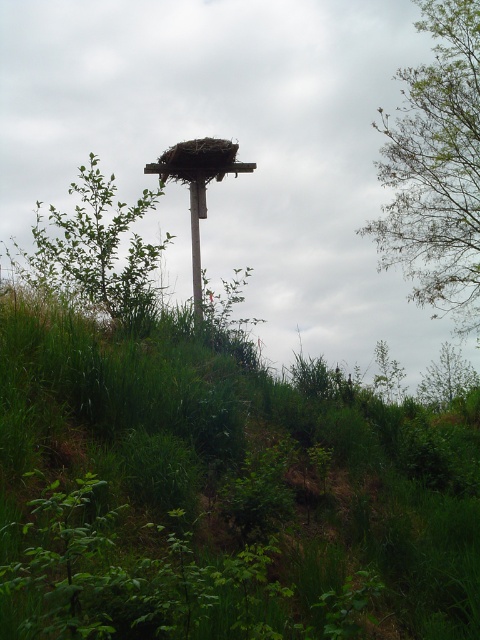
Is green grass at center thinner than green leafy tree at upper right?

Incorrect, green grass at center's width is not less than green leafy tree at upper right's.

Who is more forward, (137, 483) or (443, 13)?

Point (137, 483)

This screenshot has height=640, width=480. What do you see at coordinates (222, 492) in the screenshot?
I see `green grass at center` at bounding box center [222, 492].

This screenshot has height=640, width=480. I want to click on green grass at center, so click(222, 492).

Does green grass at center lie in front of green leafy tree at center?

Yes, it is in front of green leafy tree at center.

Is point (412, 557) farther from viewer compared to point (136, 268)?

No.

What do you see at coordinates (222, 492) in the screenshot? Image resolution: width=480 pixels, height=640 pixels. I see `green grass at center` at bounding box center [222, 492].

I want to click on green grass at center, so click(x=222, y=492).

The width and height of the screenshot is (480, 640). Find the location of `green leafy tree at upper right`. green leafy tree at upper right is located at coordinates (436, 168).

This screenshot has width=480, height=640. Describe the element at coordinates (436, 168) in the screenshot. I see `green leafy tree at upper right` at that location.

Between point (478, 154) and point (79, 291), which one is positioned behind?

Point (478, 154)

This screenshot has height=640, width=480. I want to click on green leafy tree at upper right, so click(x=436, y=168).